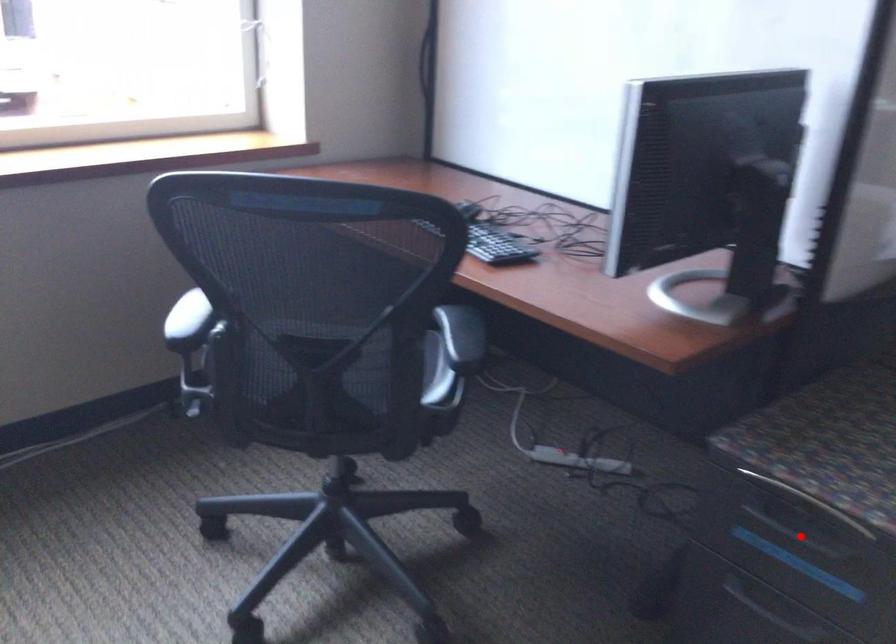
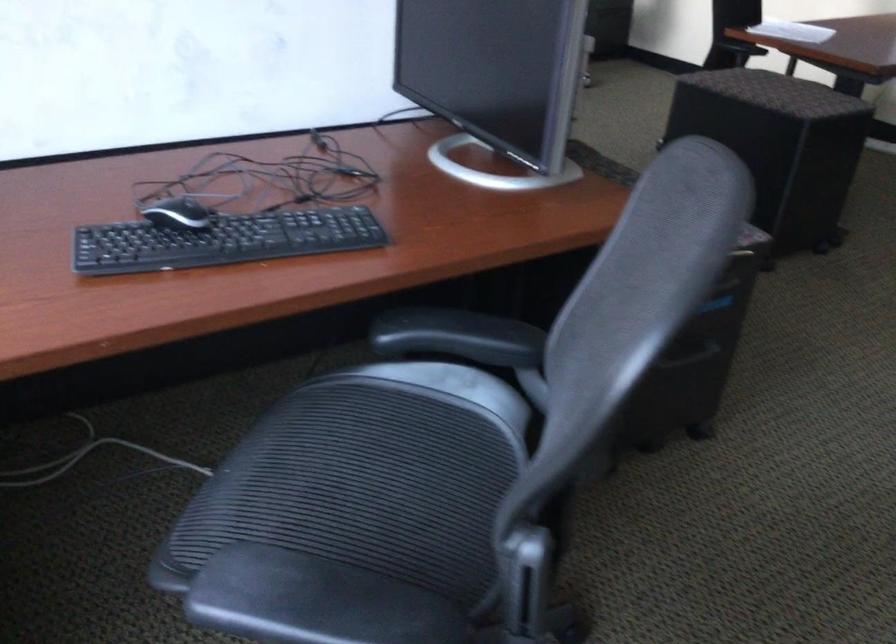
Question: I am providing you with two images of the same scene from different viewpoints. A red point is marked on the first image. Can you still see the location of the red point in image 2?

Choices:
 (A) Yes
 (B) No

Answer: (B)